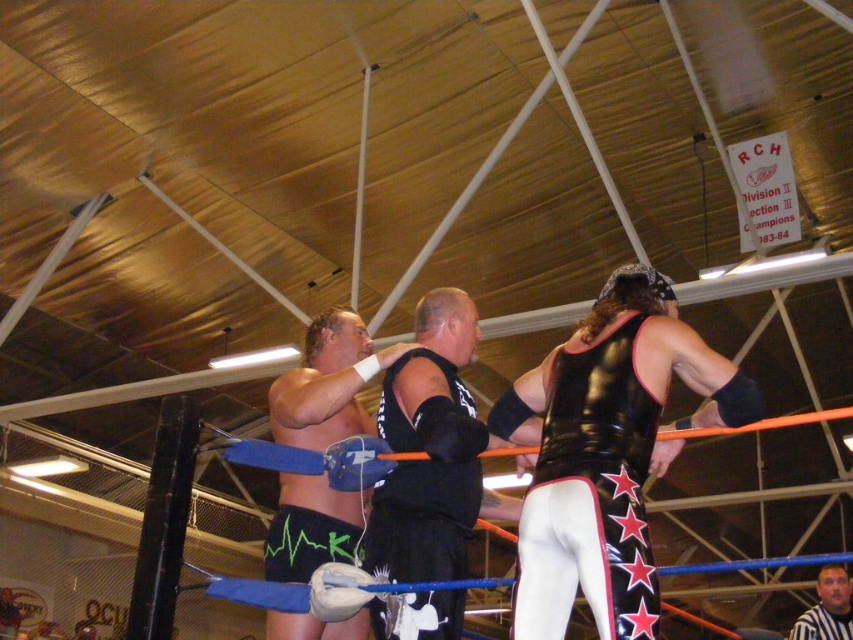
Question: Which of the following is the farthest from the observer?

Choices:
 (A) (587, 396)
 (B) (840, 566)

Answer: (B)

Question: Among these objects, which one is farthest from the camera?

Choices:
 (A) black matte vest at center
 (B) black leather vest at center

Answer: (A)

Question: Does black leather vest at center appear over smooth black shirt at center?

Choices:
 (A) no
 (B) yes

Answer: (B)

Question: Can you confirm if black leather vest at center is positioned to the left of black matte vest at center?

Choices:
 (A) no
 (B) yes

Answer: (A)

Question: Which point appears closest to the camera in this image?

Choices:
 (A) (651, 570)
 (B) (473, 330)
 (C) (844, 612)

Answer: (A)

Question: Can you confirm if black matte vest at center is wider than smooth black shirt at center?

Choices:
 (A) no
 (B) yes

Answer: (A)